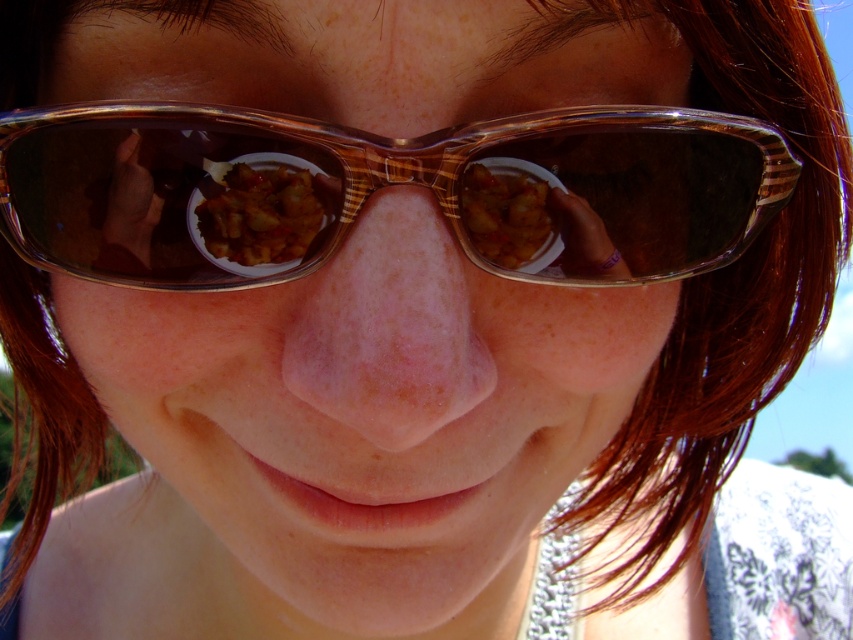
Does matte brown bowl at center appear on the left side of golden fried chicken at nose?

Yes, matte brown bowl at center is to the left of golden fried chicken at nose.

Is point (270, 209) positioned after point (505, 264)?

No, it is in front of (505, 264).

Between point (265, 186) and point (538, 198), which one is positioned in front?

Point (265, 186)

You are a GUI agent. You are given a task and a screenshot of the screen. Output one action in this format:
    pyautogui.click(x=<x>, y=<y>)
    Task: Click on the matte brown bowl at center
    The width and height of the screenshot is (853, 640).
    Given the screenshot: What is the action you would take?
    pyautogui.click(x=258, y=212)

Can you confirm if translucent brown goggles at center is positioned to the right of matte brown bowl at center?

Indeed, translucent brown goggles at center is positioned on the right side of matte brown bowl at center.

Is point (474, 180) closer to viewer compared to point (277, 262)?

That is True.

Who is more distant from viewer, (x=664, y=186) or (x=288, y=257)?

The point (x=664, y=186) is behind.

Locate an element on the screen. Image resolution: width=853 pixels, height=640 pixels. translucent brown goggles at center is located at coordinates (378, 188).

Which is more to the left, translucent brown goggles at center or golden fried chicken at nose?

From the viewer's perspective, translucent brown goggles at center appears more on the left side.

Is point (793, 180) positioned behind point (506, 166)?

Yes, it is behind point (506, 166).

Between point (711, 209) and point (527, 236), which one is positioned behind?

Positioned behind is point (711, 209).

The image size is (853, 640). What are the coordinates of `translucent brown goggles at center` in the screenshot? It's located at (378, 188).